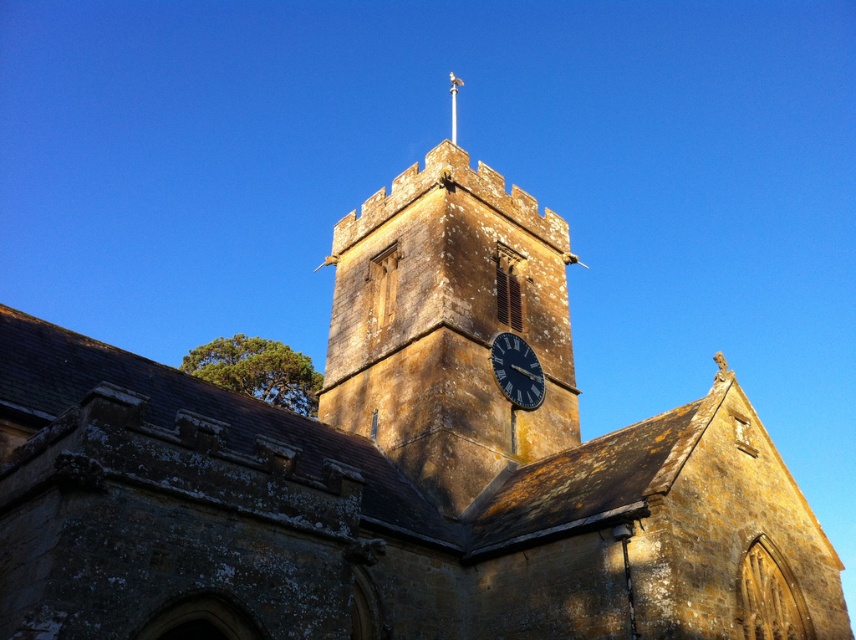
Question: Observing the image, what is the correct spatial positioning of yellow stone clock tower at center in reference to silver metallic spire at upper center?

Choices:
 (A) below
 (B) above

Answer: (A)

Question: Which object appears closest to the camera in this image?

Choices:
 (A) silver metallic spire at upper center
 (B) dark blue glass clock at center
 (C) yellow stone clock tower at center

Answer: (C)

Question: Among these objects, which one is nearest to the camera?

Choices:
 (A) dark blue glass clock at center
 (B) silver metallic spire at upper center

Answer: (A)

Question: Which point appears closest to the camera in this image?

Choices:
 (A) (521, 364)
 (B) (550, 300)
 (C) (455, 93)

Answer: (A)

Question: Is yellow stone clock tower at center smaller than silver metallic spire at upper center?

Choices:
 (A) no
 (B) yes

Answer: (A)

Question: Where is yellow stone clock tower at center located in relation to dark blue glass clock at center in the image?

Choices:
 (A) below
 (B) above

Answer: (B)